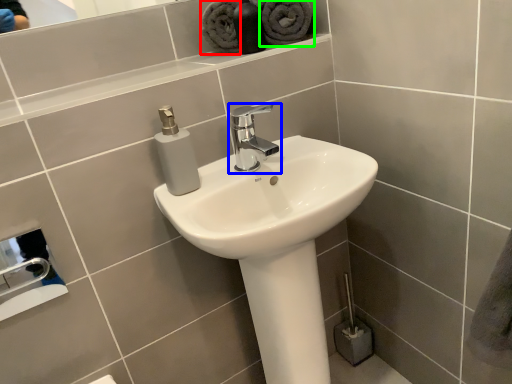
Question: Which object is positioned closest to bath towel (highlighted by a red box)? Select from tap (highlighted by a blue box) and bath towel (highlighted by a green box).

Choices:
 (A) tap
 (B) bath towel

Answer: (B)